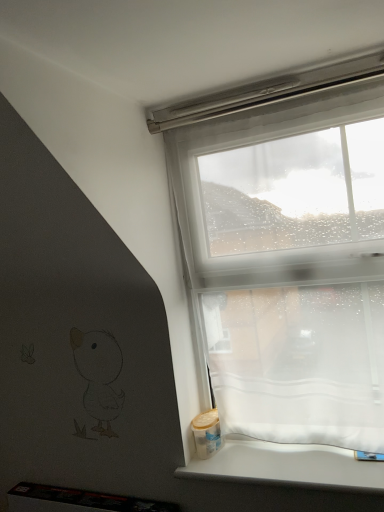
This screenshot has height=512, width=384. I want to click on empty space that is ontop of transparent fabric at upper right (from a real-world perspective), so click(253, 96).